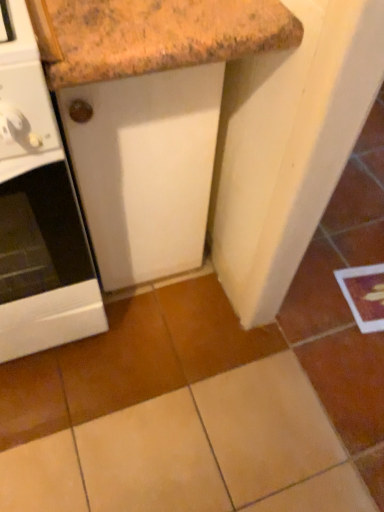
In order to click on free point to the right of white glossy oven at left in this screenshot , I will do `click(175, 344)`.